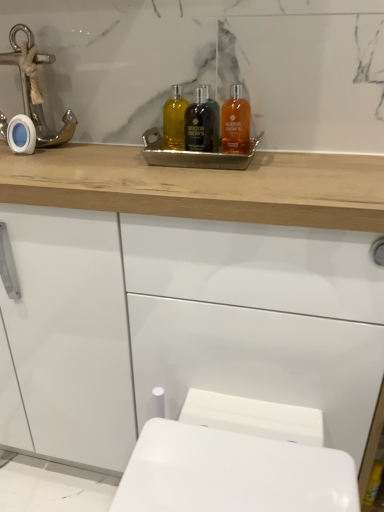
The image size is (384, 512). I want to click on vacant space that is to the left of black glass bottle at center, arranged as the 2th mouthwash when viewed from the left, so click(114, 157).